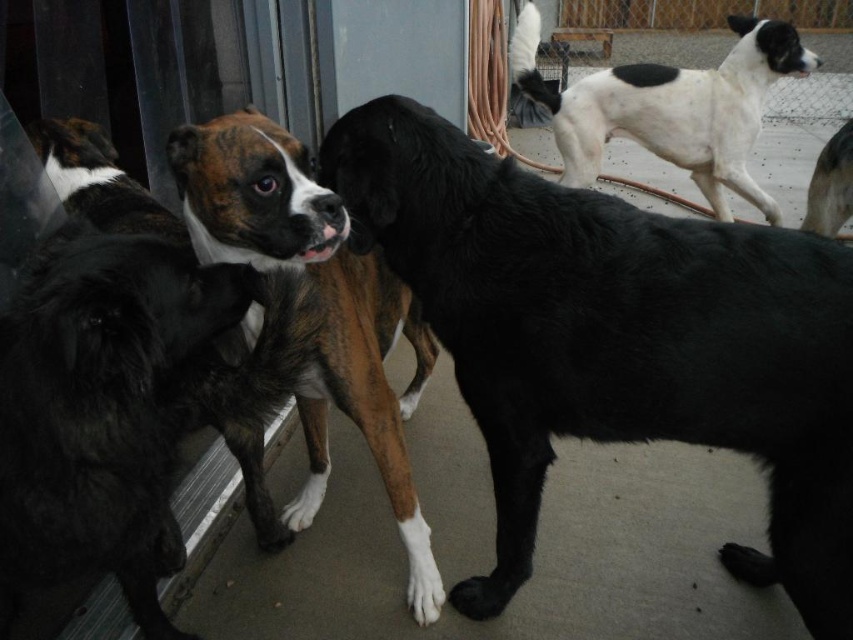
Who is more forward, [276,205] or [822,188]?

Point [276,205] is in front.

Does brown brindle fur at center appear over black glossy dog at upper right?

No.

Between point (373, 369) and point (801, 225), which one is positioned in front?

Point (373, 369) is in front.

This screenshot has height=640, width=853. I want to click on brown brindle fur at center, so click(x=323, y=305).

Which of these two, white/black fur dog at upper right or black glossy dog at upper right, stands taller?

white/black fur dog at upper right

This screenshot has width=853, height=640. In order to click on white/black fur dog at upper right in this screenshot , I will do `click(670, 108)`.

Does brown brindle fur at center have a greater width compared to white/black fur dog at upper right?

→ Incorrect, brown brindle fur at center's width does not surpass white/black fur dog at upper right's.

Does brown brindle fur at center have a larger size compared to white/black fur dog at upper right?

No.

Locate an element on the screen. Image resolution: width=853 pixels, height=640 pixels. brown brindle fur at center is located at coordinates (323, 305).

Where is `brown brindle fur at center`? The width and height of the screenshot is (853, 640). brown brindle fur at center is located at coordinates (323, 305).